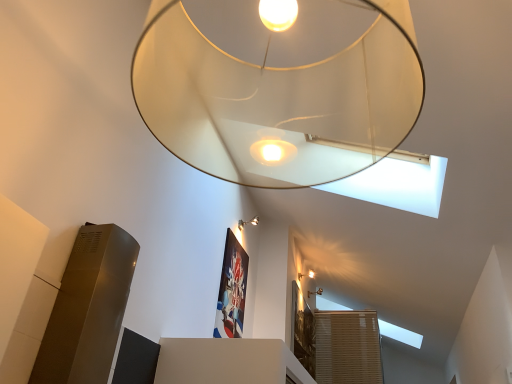
What do you see at coordinates (248, 222) in the screenshot? The width and height of the screenshot is (512, 384). I see `matte silver wall sconce at upper center, the second lamp when ordered from front to back` at bounding box center [248, 222].

The height and width of the screenshot is (384, 512). Describe the element at coordinates (307, 275) in the screenshot. I see `matte gold wall sconce at upper right, marked as the second lamp in a back-to-front arrangement` at that location.

This screenshot has height=384, width=512. I want to click on matte white lampshade at upper center, acting as the 4th lamp starting from the left, so click(x=315, y=292).

What do you see at coordinates (277, 88) in the screenshot? I see `translucent glass lampshade at upper center, which is counted as the third lamp, starting from the right` at bounding box center [277, 88].

Where is `matte silver wall sconce at upper center, which ranks as the 3th lamp in back-to-front order`? matte silver wall sconce at upper center, which ranks as the 3th lamp in back-to-front order is located at coordinates (248, 222).

Between translucent glass lampshade at upper center, acting as the 1th lamp starting from the front, and matte gold wall sconce at upper right, acting as the second lamp starting from the right, which one has less height?

matte gold wall sconce at upper right, acting as the second lamp starting from the right, is shorter.

Between translucent glass lampshade at upper center, acting as the second lamp starting from the left, and matte gold wall sconce at upper right, marked as the second lamp in a back-to-front arrangement, which one appears on the right side from the viewer's perspective?

From the viewer's perspective, matte gold wall sconce at upper right, marked as the second lamp in a back-to-front arrangement, appears more on the right side.

Consider the image. Is translucent glass lampshade at upper center, which is counted as the third lamp, starting from the right, inside or outside of matte gold wall sconce at upper right, acting as the second lamp starting from the right?

translucent glass lampshade at upper center, which is counted as the third lamp, starting from the right, is outside matte gold wall sconce at upper right, acting as the second lamp starting from the right.

Considering the points (249, 174) and (314, 274), which point is behind, point (249, 174) or point (314, 274)?

The point (314, 274) is farther.

Which object is closer to the camera taking this photo, translucent glass lampshade at upper center, the first lamp in the top-to-bottom sequence, or matte white lampshade at upper center, which appears as the 1th lamp when viewed from the right?

translucent glass lampshade at upper center, the first lamp in the top-to-bottom sequence.

In terms of width, does translucent glass lampshade at upper center, which is counted as the third lamp, starting from the right, look wider or thinner when compared to matte white lampshade at upper center, acting as the 4th lamp starting from the top?

In the image, translucent glass lampshade at upper center, which is counted as the third lamp, starting from the right, appears to be wider than matte white lampshade at upper center, acting as the 4th lamp starting from the top.

From the image's perspective, would you say translucent glass lampshade at upper center, which is counted as the third lamp, starting from the right, is shown under matte white lampshade at upper center, placed as the first lamp when sorted from bottom to top?

No, from the image's perspective, translucent glass lampshade at upper center, which is counted as the third lamp, starting from the right, is not below matte white lampshade at upper center, placed as the first lamp when sorted from bottom to top.

Between translucent glass lampshade at upper center, which appears as the fourth lamp when viewed from the back, and matte white lampshade at upper center, which is the first lamp from back to front, which one has more height?

With more height is translucent glass lampshade at upper center, which appears as the fourth lamp when viewed from the back.

From a real-world perspective, is matte silver wall sconce at upper center, the second lamp when ordered from front to back, located beneath matte white lampshade at upper center, placed as the first lamp when sorted from bottom to top?

No, from a real-world perspective, matte silver wall sconce at upper center, the second lamp when ordered from front to back, is not beneath matte white lampshade at upper center, placed as the first lamp when sorted from bottom to top.

Between matte silver wall sconce at upper center, placed as the 4th lamp when sorted from right to left, and matte white lampshade at upper center, which appears as the 1th lamp when viewed from the right, which one has larger size?

With larger size is matte silver wall sconce at upper center, placed as the 4th lamp when sorted from right to left.

Which of these two, matte silver wall sconce at upper center, arranged as the first lamp when viewed from the left, or matte white lampshade at upper center, the 4th lamp viewed from the front, is wider?

With larger width is matte silver wall sconce at upper center, arranged as the first lamp when viewed from the left.

Considering the positions of objects matte silver wall sconce at upper center, placed as the 4th lamp when sorted from right to left, and matte white lampshade at upper center, which is the first lamp from back to front, in the image provided, who is more to the right, matte silver wall sconce at upper center, placed as the 4th lamp when sorted from right to left, or matte white lampshade at upper center, which is the first lamp from back to front,?

matte white lampshade at upper center, which is the first lamp from back to front, is more to the right.

Would you consider satin silver lift at lower left to be distant from matte white lampshade at upper center, placed as the first lamp when sorted from bottom to top?

Yes, satin silver lift at lower left and matte white lampshade at upper center, placed as the first lamp when sorted from bottom to top, are quite far apart.

Is satin silver lift at lower left positioned with its back to matte white lampshade at upper center, placed as the first lamp when sorted from bottom to top?

satin silver lift at lower left does not have its back to matte white lampshade at upper center, placed as the first lamp when sorted from bottom to top.

Is satin silver lift at lower left behind matte white lampshade at upper center, acting as the 4th lamp starting from the top?

No, satin silver lift at lower left is in front of matte white lampshade at upper center, acting as the 4th lamp starting from the top.

Which object is positioned more to the right, satin silver lift at lower left or matte white lampshade at upper center, acting as the 4th lamp starting from the left?

Positioned to the right is matte white lampshade at upper center, acting as the 4th lamp starting from the left.

Considering the points (308, 274) and (311, 294), which point is behind, point (308, 274) or point (311, 294)?

The point (311, 294) is more distant.

What's the angular difference between matte gold wall sconce at upper right, arranged as the 3th lamp when viewed from the front, and matte white lampshade at upper center, the 4th lamp viewed from the front,'s facing directions?

The angular difference between matte gold wall sconce at upper right, arranged as the 3th lamp when viewed from the front, and matte white lampshade at upper center, the 4th lamp viewed from the front, is 0.0014 degrees.

Is matte gold wall sconce at upper right, acting as the third lamp starting from the top, inside or outside of matte white lampshade at upper center, the 4th lamp viewed from the front?

matte gold wall sconce at upper right, acting as the third lamp starting from the top, is outside matte white lampshade at upper center, the 4th lamp viewed from the front.

Considering the relative positions of matte gold wall sconce at upper right, acting as the second lamp starting from the right, and matte white lampshade at upper center, which appears as the 1th lamp when viewed from the right, in the image provided, is matte gold wall sconce at upper right, acting as the second lamp starting from the right, to the left or to the right of matte white lampshade at upper center, which appears as the 1th lamp when viewed from the right,?

From the image, it's evident that matte gold wall sconce at upper right, acting as the second lamp starting from the right, is to the left of matte white lampshade at upper center, which appears as the 1th lamp when viewed from the right.

Which is behind, point (79, 278) or point (265, 25)?

The point (79, 278) is behind.

Considering the positions of objects satin silver lift at lower left and translucent glass lampshade at upper center, which is counted as the third lamp, starting from the right, in the image provided, who is in front, satin silver lift at lower left or translucent glass lampshade at upper center, which is counted as the third lamp, starting from the right,?

translucent glass lampshade at upper center, which is counted as the third lamp, starting from the right, is in front.

In terms of size, does satin silver lift at lower left appear bigger or smaller than translucent glass lampshade at upper center, which is counted as the third lamp, starting from the right?

satin silver lift at lower left is smaller than translucent glass lampshade at upper center, which is counted as the third lamp, starting from the right.

Considering the points (312, 273) and (368, 89), which point is behind, point (312, 273) or point (368, 89)?

Point (312, 273)

Is matte gold wall sconce at upper right, the second lamp in the bottom-to-top sequence, at the right side of translucent glass lampshade at upper center, the 4th lamp ordered from the bottom?

Yes, matte gold wall sconce at upper right, the second lamp in the bottom-to-top sequence, is to the right of translucent glass lampshade at upper center, the 4th lamp ordered from the bottom.

How many degrees apart are the facing directions of matte gold wall sconce at upper right, marked as the second lamp in a back-to-front arrangement, and translucent glass lampshade at upper center, which is counted as the third lamp, starting from the right?

The facing directions of matte gold wall sconce at upper right, marked as the second lamp in a back-to-front arrangement, and translucent glass lampshade at upper center, which is counted as the third lamp, starting from the right, are 90.4 degrees apart.

Would you consider matte gold wall sconce at upper right, positioned as the third lamp in left-to-right order, to be distant from translucent glass lampshade at upper center, acting as the second lamp starting from the left?

matte gold wall sconce at upper right, positioned as the third lamp in left-to-right order, is positioned a significant distance from translucent glass lampshade at upper center, acting as the second lamp starting from the left.

I want to click on lamp that appears below the matte gold wall sconce at upper right, positioned as the third lamp in left-to-right order (from a real-world perspective), so click(277, 88).

Image resolution: width=512 pixels, height=384 pixels. I want to click on the 3rd lamp above when counting from the matte white lampshade at upper center, acting as the 4th lamp starting from the top (from the image's perspective), so click(277, 88).

When comparing their distances from matte gold wall sconce at upper right, positioned as the third lamp in left-to-right order, does matte silver wall sconce at upper center, the second lamp when ordered from front to back, or translucent glass lampshade at upper center, acting as the second lamp starting from the left, seem further?

translucent glass lampshade at upper center, acting as the second lamp starting from the left, lies further to matte gold wall sconce at upper right, positioned as the third lamp in left-to-right order, than the other object.

Looking at this image, looking at the image, which one is located further to matte silver wall sconce at upper center, the third lamp ordered from the bottom, translucent glass lampshade at upper center, the first lamp in the top-to-bottom sequence, or matte gold wall sconce at upper right, acting as the third lamp starting from the top?

translucent glass lampshade at upper center, the first lamp in the top-to-bottom sequence.

From the image, which object appears to be farther from translucent glass lampshade at upper center, acting as the second lamp starting from the left, matte white lampshade at upper center, which appears as the 1th lamp when viewed from the right, or matte silver wall sconce at upper center, the second lamp when ordered from front to back?

The object further to translucent glass lampshade at upper center, acting as the second lamp starting from the left, is matte white lampshade at upper center, which appears as the 1th lamp when viewed from the right.

Based on the photo, when comparing their distances from matte gold wall sconce at upper right, positioned as the third lamp in left-to-right order, does satin silver lift at lower left or translucent glass lampshade at upper center, acting as the 1th lamp starting from the front, seem closer?

satin silver lift at lower left.

Considering their positions, is matte white lampshade at upper center, the 4th lamp viewed from the front, positioned closer to matte silver wall sconce at upper center, the third lamp ordered from the bottom, than translucent glass lampshade at upper center, which appears as the fourth lamp when viewed from the back?

matte white lampshade at upper center, the 4th lamp viewed from the front, is positioned closer to the anchor matte silver wall sconce at upper center, the third lamp ordered from the bottom.

Which object lies nearer to the anchor point matte white lampshade at upper center, which appears as the 1th lamp when viewed from the right, matte silver wall sconce at upper center, the third lamp ordered from the bottom, or satin silver lift at lower left?

matte silver wall sconce at upper center, the third lamp ordered from the bottom, is closer to matte white lampshade at upper center, which appears as the 1th lamp when viewed from the right.

Based on their spatial positions, is satin silver lift at lower left or matte white lampshade at upper center, acting as the 4th lamp starting from the left, closer to matte silver wall sconce at upper center, the 2th lamp viewed from the top?

matte white lampshade at upper center, acting as the 4th lamp starting from the left, is closer to matte silver wall sconce at upper center, the 2th lamp viewed from the top.

When comparing their distances from satin silver lift at lower left, does translucent glass lampshade at upper center, which appears as the fourth lamp when viewed from the back, or matte silver wall sconce at upper center, arranged as the first lamp when viewed from the left, seem further?

matte silver wall sconce at upper center, arranged as the first lamp when viewed from the left.

Where is `lift between translucent glass lampshade at upper center, the 4th lamp ordered from the bottom, and matte gold wall sconce at upper right, arranged as the 3th lamp when viewed from the front, along the z-axis`? The width and height of the screenshot is (512, 384). lift between translucent glass lampshade at upper center, the 4th lamp ordered from the bottom, and matte gold wall sconce at upper right, arranged as the 3th lamp when viewed from the front, along the z-axis is located at coordinates (88, 308).

I want to click on lamp between translucent glass lampshade at upper center, which is counted as the third lamp, starting from the right, and matte gold wall sconce at upper right, acting as the second lamp starting from the right, in the front-back direction, so click(x=248, y=222).

Locate an element on the screen. The width and height of the screenshot is (512, 384). lamp positioned between matte silver wall sconce at upper center, which ranks as the 3th lamp in back-to-front order, and matte white lampshade at upper center, which appears as the 1th lamp when viewed from the right, from near to far is located at coordinates (307, 275).

Image resolution: width=512 pixels, height=384 pixels. Identify the location of lift located between translucent glass lampshade at upper center, acting as the 1th lamp starting from the front, and matte white lampshade at upper center, acting as the 4th lamp starting from the top, in the depth direction. (88, 308).